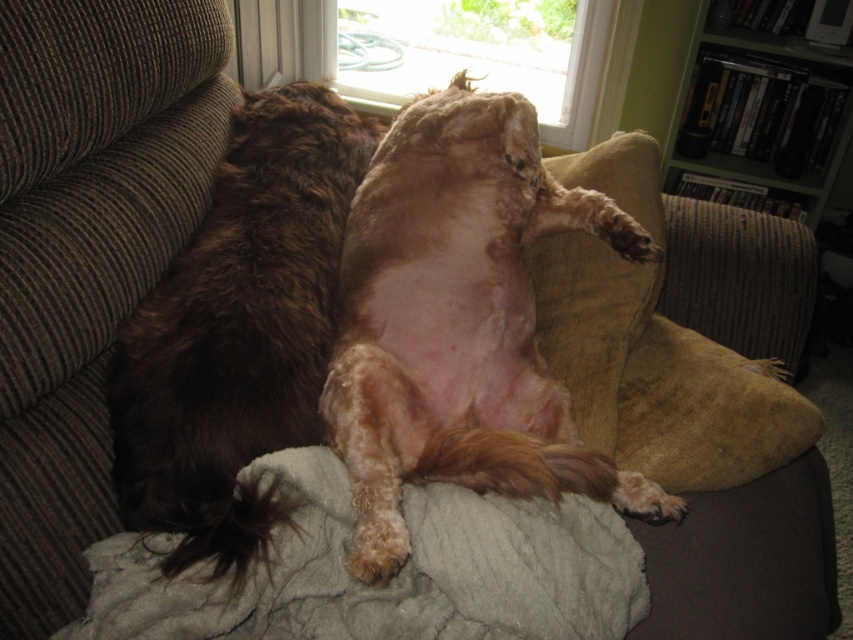
You are a pet sitter who needs to place a 20 cm wide toy next to the fuzzy brown dog at center and the soft gray blanket at center. Can you fit the toy between them without moving either object?

The distance between the fuzzy brown dog at center and the soft gray blanket at center is 19.85 centimeters. Since the toy is 20 cm wide, it cannot fit between them as the space is slightly narrower than the toy.

You are standing in front of the couch where the dog is lying. There are two points marked on the couch. One is at coordinate point (480, 513) and the other is at point (314, 8). Which of these two points is closer to you?

Point (480, 513) is closer to the viewer than point (314, 8).